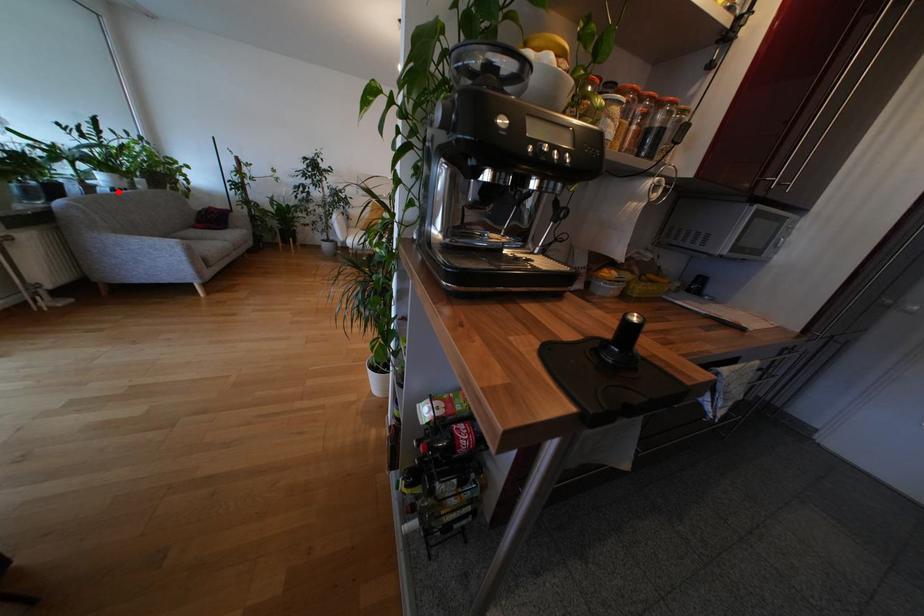
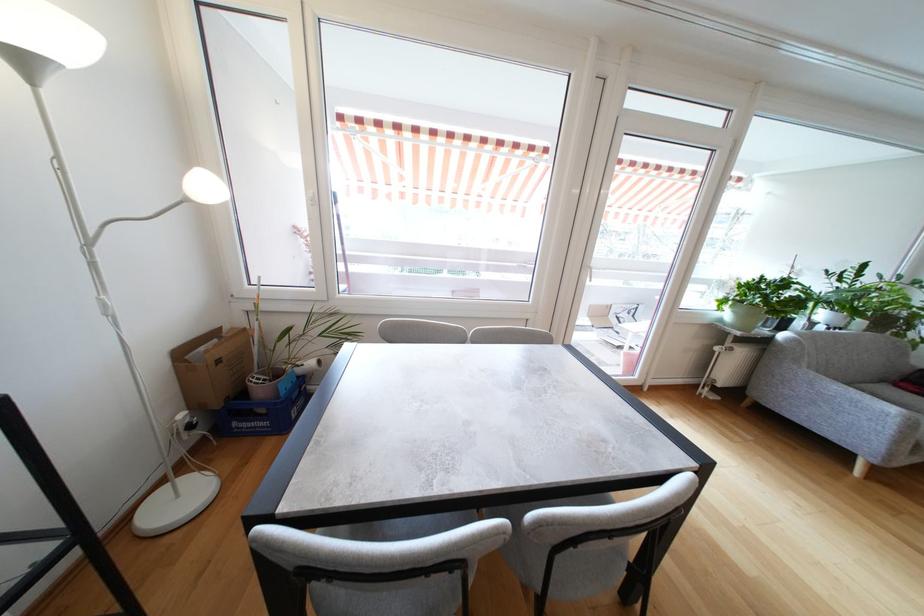
Question: I am providing you with two images of the same scene from different viewpoints. A red point is marked on the first image. Can you still see the location of the red point in image 2?

Choices:
 (A) Yes
 (B) No

Answer: (A)